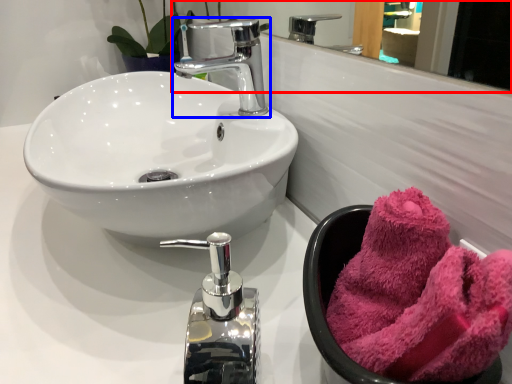
Question: Among these objects, which one is nearest to the camera, mirror (highlighted by a red box) or tap (highlighted by a blue box)?

Choices:
 (A) mirror
 (B) tap

Answer: (A)